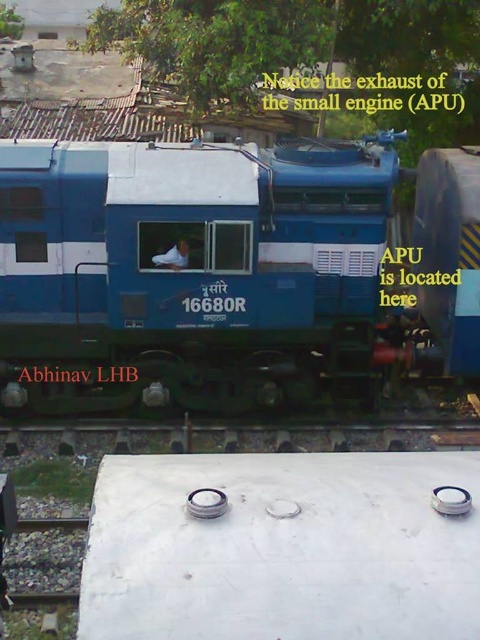
Is blue matte train at center taller than gray concrete train track at bottom?

Indeed, blue matte train at center has a greater height compared to gray concrete train track at bottom.

Who is shorter, blue matte train at center or gray concrete train track at bottom?

gray concrete train track at bottom

At what (x,y) coordinates should I click in order to perform the action: click on blue matte train at center. Please return your answer as a coordinate pair (x, y). This screenshot has width=480, height=640. Looking at the image, I should click on (228, 269).

Locate an element on the screen. Image resolution: width=480 pixels, height=640 pixels. blue matte train at center is located at coordinates (228, 269).